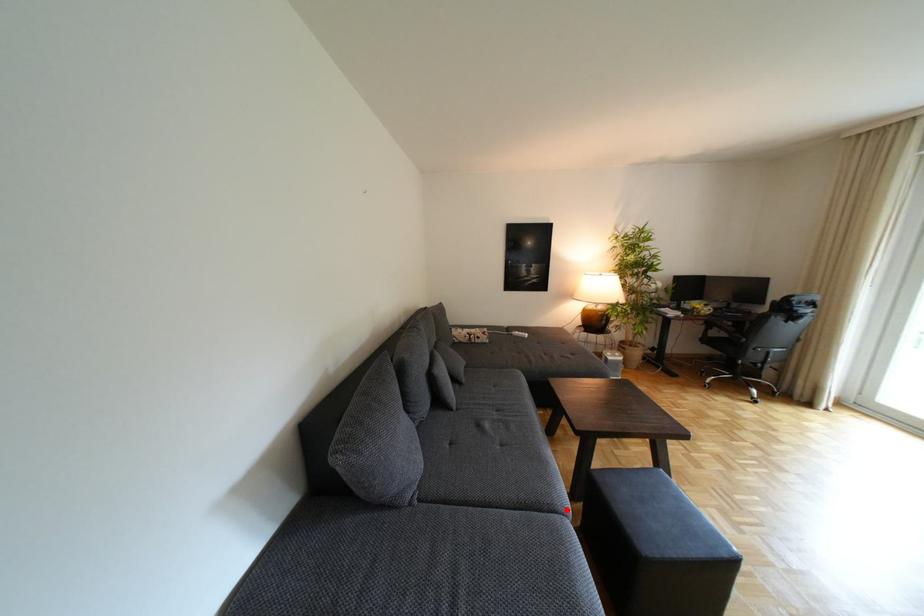
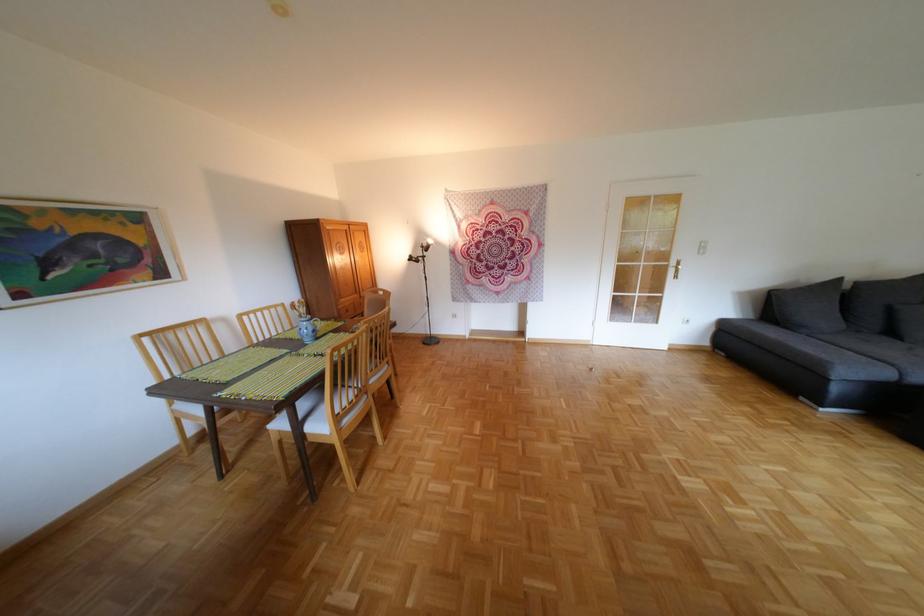
Find the pixel in the second image that matches the highlighted location in the first image.

(906, 365)